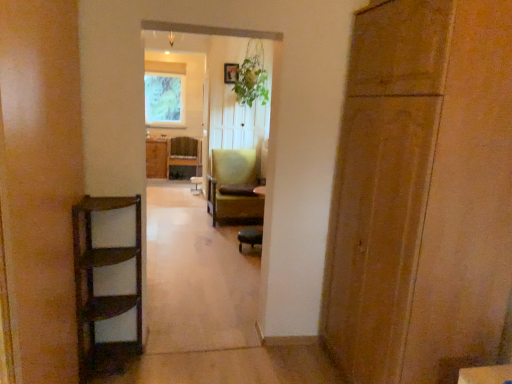
The image size is (512, 384). What do you see at coordinates (165, 94) in the screenshot?
I see `green textured fabric at upper center` at bounding box center [165, 94].

Identify the location of green textured fabric at upper center. (165, 94).

Identify the location of matte brown cabinet at center. (156, 159).

Find the location of a particular element. This screenshot has height=384, width=512. matte black chair at center, the third chair viewed from the left is located at coordinates (249, 237).

This screenshot has width=512, height=384. What do you see at coordinates (184, 157) in the screenshot?
I see `wooden chair at center, arranged as the 3th chair when viewed from the right` at bounding box center [184, 157].

Identify the location of green textured fabric at upper center. (165, 94).

Does matte brown cabinet at center appear on the right side of matte black chair at center, which is the 1th chair from front to back?

No, matte brown cabinet at center is not to the right of matte black chair at center, which is the 1th chair from front to back.

Is matte brown cabinet at center taller or shorter than matte black chair at center, which ranks as the first chair in right-to-left order?

matte brown cabinet at center is taller than matte black chair at center, which ranks as the first chair in right-to-left order.

Which object is further away from the camera taking this photo, matte brown cabinet at center or matte black chair at center, the third chair viewed from the left?

matte brown cabinet at center is behind.

Looking at this image, is matte brown cabinet at center touching matte black chair at center, the third chair viewed from the left?

No, matte brown cabinet at center is not beside matte black chair at center, the third chair viewed from the left.

From a real-world perspective, is wooden chair at center, arranged as the 3th chair when viewed from the right, physically located above or below matte brown cabinet at center?

From a real-world perspective, wooden chair at center, arranged as the 3th chair when viewed from the right, is physically below matte brown cabinet at center.

Between wooden chair at center, arranged as the first chair when viewed from the left, and matte brown cabinet at center, which one appears on the right side from the viewer's perspective?

wooden chair at center, arranged as the first chair when viewed from the left, is more to the right.

Looking at their sizes, would you say wooden chair at center, arranged as the 3th chair when viewed from the right, is wider or thinner than matte brown cabinet at center?

Considering their sizes, wooden chair at center, arranged as the 3th chair when viewed from the right, looks broader than matte brown cabinet at center.

Based on the photo, between matte black chair at center, the third chair viewed from the left, and green textured fabric at upper center, which one has larger size?

green textured fabric at upper center is bigger.

From a real-world perspective, which is physically below, matte black chair at center, the third chair viewed from the left, or green textured fabric at upper center?

matte black chair at center, the third chair viewed from the left, is physically lower.

Does matte black chair at center, which ranks as the first chair in right-to-left order, lie in front of green textured fabric at upper center?

Yes, matte black chair at center, which ranks as the first chair in right-to-left order, is closer to the camera.

Is green textured fabric at upper center at the back of matte black chair at center, the third chair viewed from the left?

No, matte black chair at center, the third chair viewed from the left, is not facing away from green textured fabric at upper center.

Does matte brown cabinet at center come in front of green fabric chair at center, the 2th chair from the right?

That is False.

Which point is more forward, (154, 163) or (231, 183)?

The point (231, 183) is in front.

From the image's perspective, is matte brown cabinet at center above or below green fabric chair at center, which is the second chair in left-to-right order?

Clearly, from the image's perspective, matte brown cabinet at center is above green fabric chair at center, which is the second chair in left-to-right order.

Is matte brown cabinet at center aimed at green fabric chair at center, which is the second chair from back to front?

No, matte brown cabinet at center is not facing towards green fabric chair at center, which is the second chair from back to front.

In the scene shown: Which object is thinner, wooden door at right or green textured fabric at upper center?

With smaller width is green textured fabric at upper center.

Looking at this image, is wooden door at right shorter than green textured fabric at upper center?

In fact, wooden door at right may be taller than green textured fabric at upper center.

Who is bigger, wooden door at right or green textured fabric at upper center?

With larger size is wooden door at right.

Based on the photo, is wooden door at right shorter than green fabric chair at center, positioned as the 2th chair in front-to-back order?

No.

From a real-world perspective, is wooden door at right above or below green fabric chair at center, which is the second chair in left-to-right order?

From a real-world perspective, wooden door at right is physically above green fabric chair at center, which is the second chair in left-to-right order.

From the wooden door at right, count 2nd chairs backward and point to it. Please provide its 2D coordinates.

[(234, 187)]

Is matte black chair at center, which ranks as the first chair in right-to-left order, outside of green fabric chair at center, positioned as the 2th chair in front-to-back order?

Yes, matte black chair at center, which ranks as the first chair in right-to-left order, is not within green fabric chair at center, positioned as the 2th chair in front-to-back order.

Does matte black chair at center, which ranks as the first chair in right-to-left order, appear on the left side of green fabric chair at center, which is the second chair from back to front?

No, matte black chair at center, which ranks as the first chair in right-to-left order, is not to the left of green fabric chair at center, which is the second chair from back to front.

Which of these two, matte black chair at center, which ranks as the first chair in right-to-left order, or green fabric chair at center, positioned as the 2th chair in front-to-back order, is thinner?

matte black chair at center, which ranks as the first chair in right-to-left order, is thinner.

From a real-world perspective, which chair is the 2nd one underneath the matte brown cabinet at center? Please provide its 2D coordinates.

[(249, 237)]

The height and width of the screenshot is (384, 512). Identify the location of cabinetry located behind the wooden chair at center, arranged as the 3th chair when viewed from the right. (156, 159).

Looking at the image, which one is located closer to matte black chair at center, which is the 1th chair from front to back, green textured fabric at upper center or matte brown cabinet at center?

matte brown cabinet at center.

Considering their positions, is green leafy plant at center positioned further to matte brown cabinet at center than wooden chair at center, arranged as the first chair when viewed from the left?

The object further to matte brown cabinet at center is green leafy plant at center.

When comparing their distances from wooden chair at center, acting as the third chair starting from the front, does matte brown cabinet at center or matte black chair at center, which ranks as the first chair in right-to-left order, seem closer?

The object closer to wooden chair at center, acting as the third chair starting from the front, is matte brown cabinet at center.

When comparing their distances from green fabric chair at center, which is the second chair in left-to-right order, does matte brown cabinet at center or wooden door at right seem further?

wooden door at right is positioned further to the anchor green fabric chair at center, which is the second chair in left-to-right order.

Based on their spatial positions, is matte brown cabinet at center or wooden chair at center, acting as the first chair starting from the back, further from wooden door at right?

matte brown cabinet at center.

Considering their positions, is matte black chair at center, the third chair viewed from the left, positioned closer to wooden door at right than green textured fabric at upper center?

The object closer to wooden door at right is matte black chair at center, the third chair viewed from the left.

Considering their positions, is matte brown cabinet at center positioned closer to wooden chair at center, acting as the first chair starting from the back, than green leafy plant at center?

matte brown cabinet at center is positioned closer to the anchor wooden chair at center, acting as the first chair starting from the back.

Considering their positions, is wooden chair at center, arranged as the first chair when viewed from the left, positioned further to green leafy plant at center than green fabric chair at center, positioned as the 2th chair in front-to-back order?

wooden chair at center, arranged as the first chair when viewed from the left, is further to green leafy plant at center.

This screenshot has height=384, width=512. I want to click on cabinetry between green fabric chair at center, which is the second chair from back to front, and green textured fabric at upper center from front to back, so click(156, 159).

I want to click on plant between wooden door at right and green textured fabric at upper center along the z-axis, so click(x=252, y=77).

Identify the location of chair positioned between green leafy plant at center and wooden chair at center, acting as the third chair starting from the front, from near to far. (234, 187).

This screenshot has height=384, width=512. In order to click on plant between matte black chair at center, which ranks as the first chair in right-to-left order, and wooden chair at center, acting as the first chair starting from the back, in the front-back direction in this screenshot , I will do `click(252, 77)`.